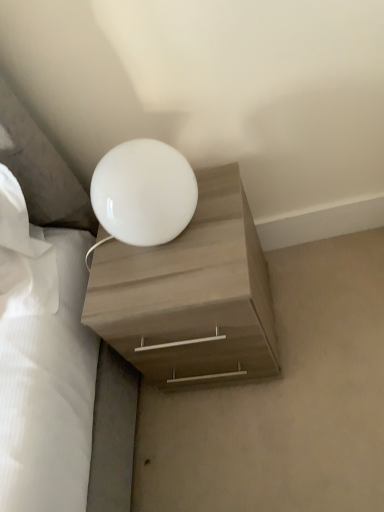
Question: Can you confirm if white glossy sphere at upper center is positioned to the right of white glossy lamp at upper center?

Choices:
 (A) no
 (B) yes

Answer: (A)

Question: Is white glossy sphere at upper center wider than white glossy lamp at upper center?

Choices:
 (A) no
 (B) yes

Answer: (A)

Question: Is white glossy sphere at upper center positioned behind white glossy lamp at upper center?

Choices:
 (A) no
 (B) yes

Answer: (A)

Question: Does white glossy sphere at upper center have a lesser height compared to white glossy lamp at upper center?

Choices:
 (A) no
 (B) yes

Answer: (A)

Question: Is white glossy sphere at upper center smaller than white glossy lamp at upper center?

Choices:
 (A) no
 (B) yes

Answer: (B)

Question: Based on their sizes in the image, would you say white glossy sphere at upper center is bigger or smaller than white glossy lamp at upper center?

Choices:
 (A) big
 (B) small

Answer: (B)

Question: In terms of height, does white glossy sphere at upper center look taller or shorter compared to white glossy lamp at upper center?

Choices:
 (A) short
 (B) tall

Answer: (B)

Question: Would you say white glossy sphere at upper center is to the left or to the right of white glossy lamp at upper center in the picture?

Choices:
 (A) left
 (B) right

Answer: (A)

Question: Is white glossy sphere at upper center wider or thinner than white glossy lamp at upper center?

Choices:
 (A) wide
 (B) thin

Answer: (B)

Question: Considering their positions, is matte wood nightstand at center located in front of or behind white glossy sphere at upper center?

Choices:
 (A) behind
 (B) front

Answer: (A)

Question: Looking at the image, does matte wood nightstand at center seem bigger or smaller compared to white glossy sphere at upper center?

Choices:
 (A) small
 (B) big

Answer: (B)

Question: Is matte wood nightstand at center wider or thinner than white glossy sphere at upper center?

Choices:
 (A) thin
 (B) wide

Answer: (B)

Question: Considering the positions of matte wood nightstand at center and white glossy sphere at upper center in the image, is matte wood nightstand at center taller or shorter than white glossy sphere at upper center?

Choices:
 (A) tall
 (B) short

Answer: (A)

Question: From the image's perspective, relative to matte wood nightstand at center, is white glossy lamp at upper center above or below?

Choices:
 (A) below
 (B) above

Answer: (A)

Question: In terms of width, does white glossy lamp at upper center look wider or thinner when compared to matte wood nightstand at center?

Choices:
 (A) thin
 (B) wide

Answer: (B)